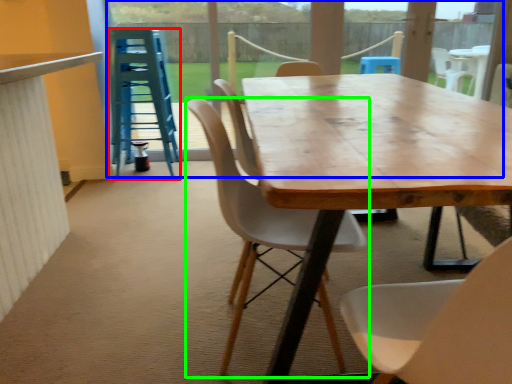
Question: Based on their relative distances, which object is nearer to stool (highlighted by a red box)? Choose from glass door (highlighted by a blue box) and chair (highlighted by a green box).

Choices:
 (A) glass door
 (B) chair

Answer: (A)